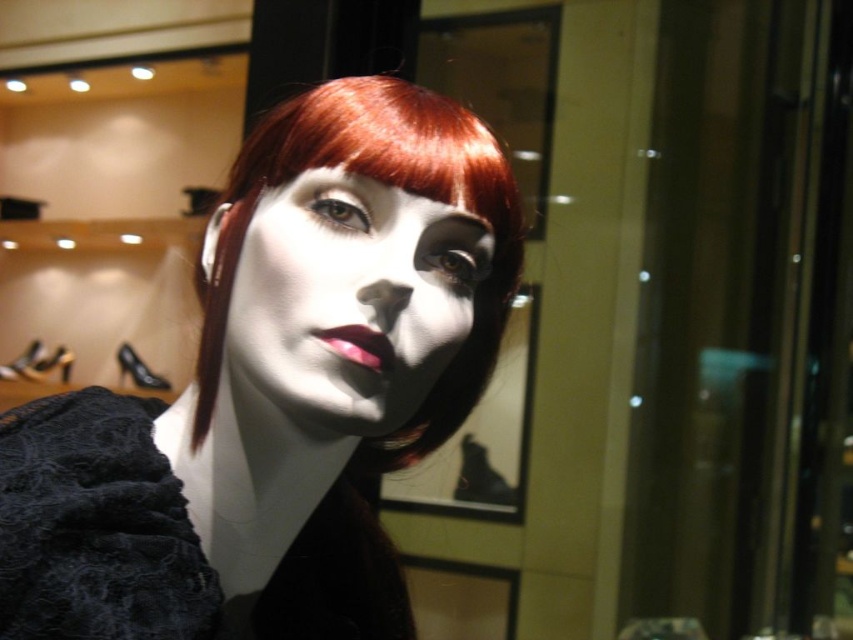
You are a customer in a store looking at the mannequin head. Where exactly is the lace fabric dress at center located in the image? Please provide the coordinates.

The lace fabric dress at center is located at coordinates point (97, 525).

You are a makeup artist preparing for a photoshoot. You have to place the matte black wig at center and the matte pink lipstick at center on a shelf. The shelf has a height limit of 15 cm. Can both items fit vertically on the shelf without exceeding the height limit?

The matte black wig at center has a greater height compared to the matte pink lipstick at center. However, since the shelf has a height limit of 15 cm and the description only states the relative height between the two items, it is unclear if either item individually meets the height requirement. Additional information about each item s specific height is needed to determine if they can fit.

You are a customer in a store and want to examine the matte black wig at center closely. If you step forward by 12 inches, will you be able to see the wig more clearly?

The matte black wig at center is currently 15.79 inches away from you. If you step forward by 12 inches, your new distance will be 3.79 inches. This closer proximity allows for a clearer examination of the wig.